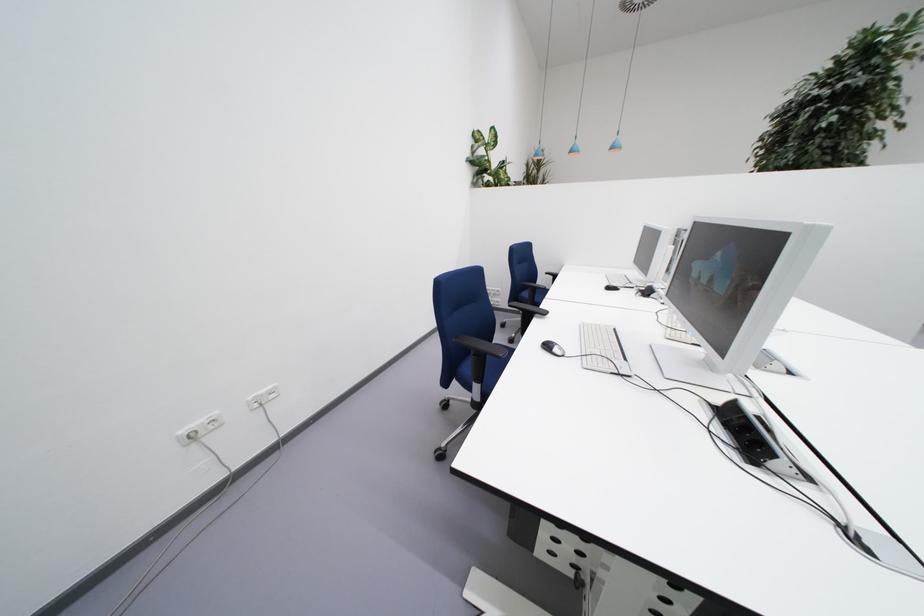
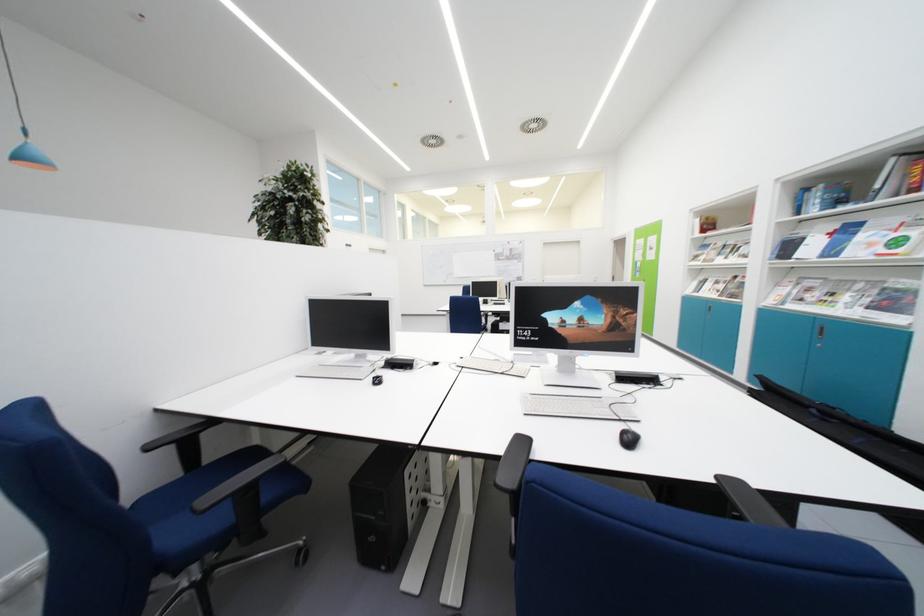
Find the pixel in the second image that matches the point at 554,351 in the first image.

(637, 446)